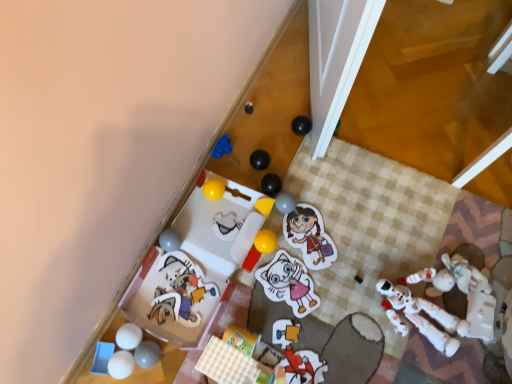
What are the coordinates of `free spot to the right of white plastic toy at lower right, marked as the first toy in a right-to-left arrangement` in the screenshot? It's located at (488, 317).